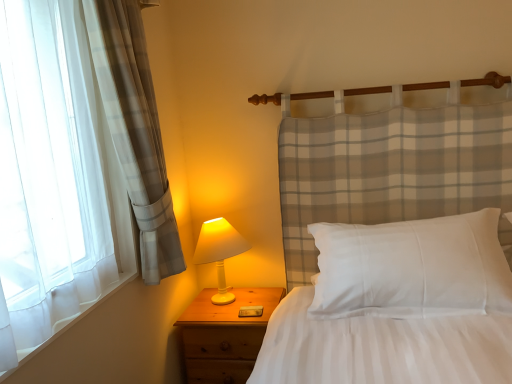
Question: From the image's perspective, is white cotton pillow at center below white matte table lamp at lower left?

Choices:
 (A) no
 (B) yes

Answer: (A)

Question: Does white cotton pillow at center have a greater width compared to white matte table lamp at lower left?

Choices:
 (A) no
 (B) yes

Answer: (B)

Question: Considering the relative positions of white cotton pillow at center and white matte table lamp at lower left in the image provided, is white cotton pillow at center in front of white matte table lamp at lower left?

Choices:
 (A) no
 (B) yes

Answer: (B)

Question: Is white cotton pillow at center far away from white matte table lamp at lower left?

Choices:
 (A) no
 (B) yes

Answer: (A)

Question: Can you confirm if white cotton pillow at center is positioned to the left of white matte table lamp at lower left?

Choices:
 (A) no
 (B) yes

Answer: (A)

Question: Is white cotton pillow at center at the right side of white matte table lamp at lower left?

Choices:
 (A) yes
 (B) no

Answer: (A)

Question: Is white cotton pillow at center thinner than wooden nightstand at lower left?

Choices:
 (A) yes
 (B) no

Answer: (A)

Question: Is white cotton pillow at center not inside wooden nightstand at lower left?

Choices:
 (A) yes
 (B) no

Answer: (A)

Question: From a real-world perspective, is white cotton pillow at center on top of wooden nightstand at lower left?

Choices:
 (A) no
 (B) yes

Answer: (B)

Question: Can you confirm if white cotton pillow at center is shorter than wooden nightstand at lower left?

Choices:
 (A) no
 (B) yes

Answer: (B)

Question: Can wooden nightstand at lower left be found inside white cotton pillow at center?

Choices:
 (A) yes
 (B) no

Answer: (B)

Question: Is there a large distance between white cotton pillow at center and wooden nightstand at lower left?

Choices:
 (A) yes
 (B) no

Answer: (B)

Question: Could you tell me if white matte table lamp at lower left is turned towards wooden nightstand at lower left?

Choices:
 (A) yes
 (B) no

Answer: (B)